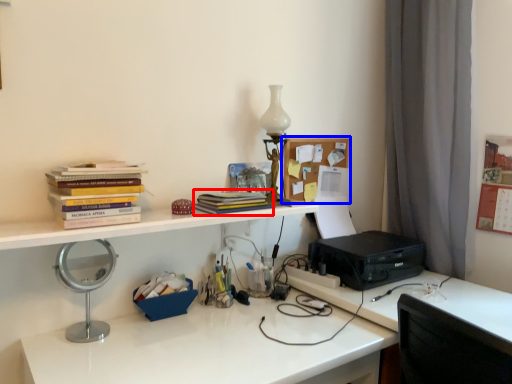
Question: Among these objects, which one is nearest to the camera, book (highlighted by a red box) or shelf (highlighted by a blue box)?

Choices:
 (A) book
 (B) shelf

Answer: (A)